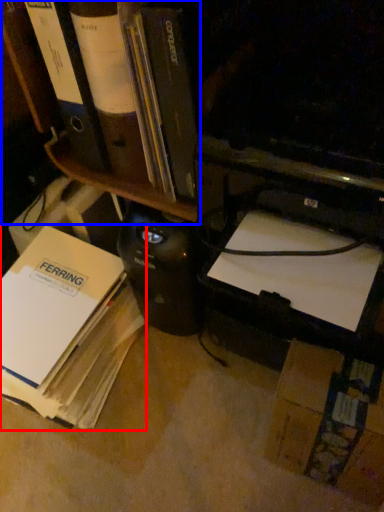
Question: Which object is closer to the camera taking this photo, book (highlighted by a red box) or bookshelf (highlighted by a blue box)?

Choices:
 (A) book
 (B) bookshelf

Answer: (B)